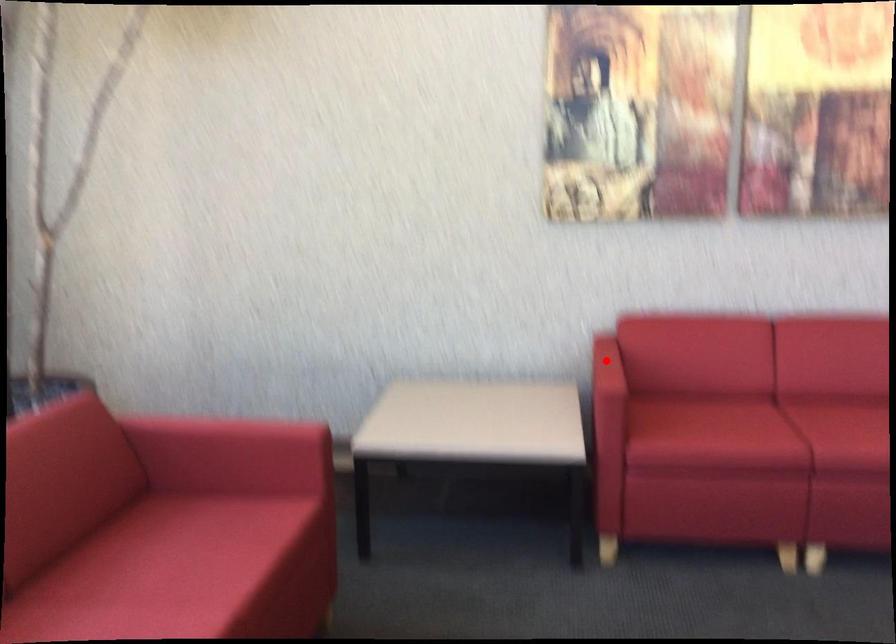
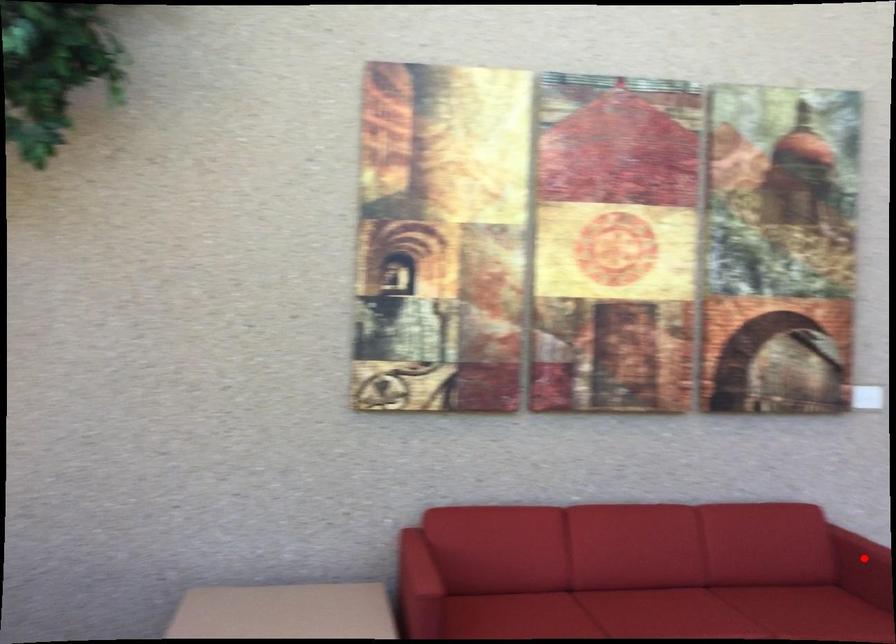
I am providing you with two images of the same scene from different viewpoints. A red point is marked on the first image and another point is marked on the second image. Is the marked point in image1 the same physical position as the marked point in image2?

No